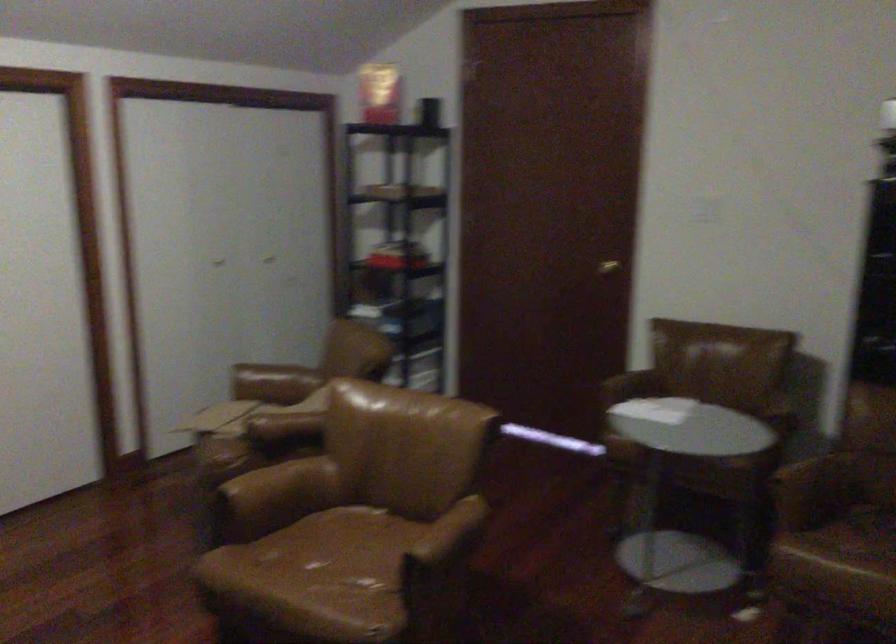
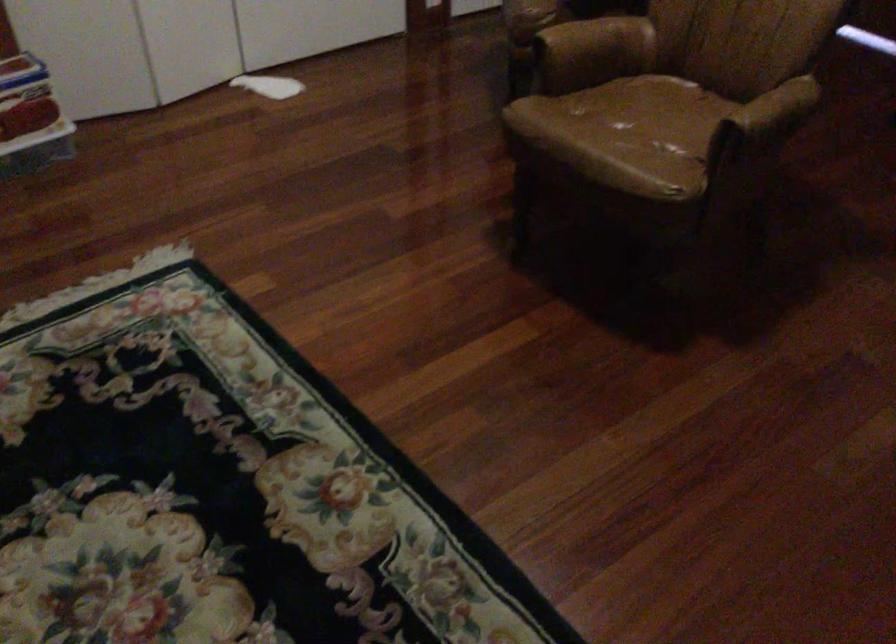
Where in the second image is the point corresponding to point (453, 536) from the first image?

(776, 109)